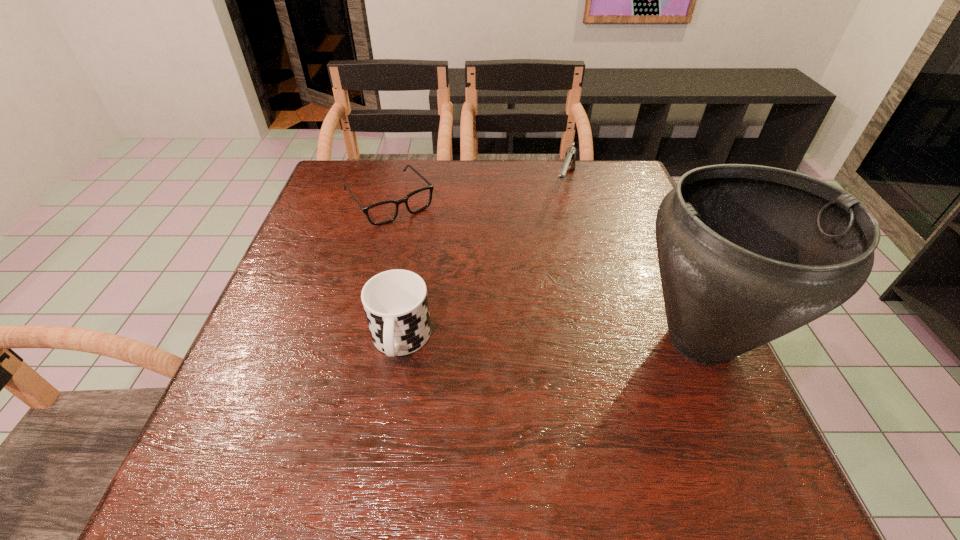
Where is `cup`? This screenshot has width=960, height=540. cup is located at coordinates (395, 302).

Where is `the tallest object`? The height and width of the screenshot is (540, 960). the tallest object is located at coordinates (747, 254).

Find the location of a particular element. This screenshot has width=960, height=540. the shortest object is located at coordinates (384, 212).

This screenshot has width=960, height=540. I want to click on the third tallest object, so click(x=569, y=162).

I want to click on vacant space located on the side of the cup with the handle, so click(x=387, y=421).

The width and height of the screenshot is (960, 540). I want to click on vacant space located 0.050m on the front of the tallest object, so click(x=744, y=436).

Image resolution: width=960 pixels, height=540 pixels. What are the coordinates of `vacant space located on the front-facing side of the spectacles` in the screenshot? It's located at (462, 285).

You are a GUI agent. You are given a task and a screenshot of the screen. Output one action in this format:
    pyautogui.click(x=<x>, y=<y>)
    Task: Click on the vacant space located 0.200m on the front-facing side of the spectacles
    Image resolution: width=960 pixels, height=540 pixels.
    Given the screenshot: What is the action you would take?
    pyautogui.click(x=448, y=269)

Locate an element on the screen. The width and height of the screenshot is (960, 540). vacant space situated on the front-facing side of the spectacles is located at coordinates (436, 254).

Where is `vacant space located aiming along the barrel of the gun`? vacant space located aiming along the barrel of the gun is located at coordinates (534, 302).